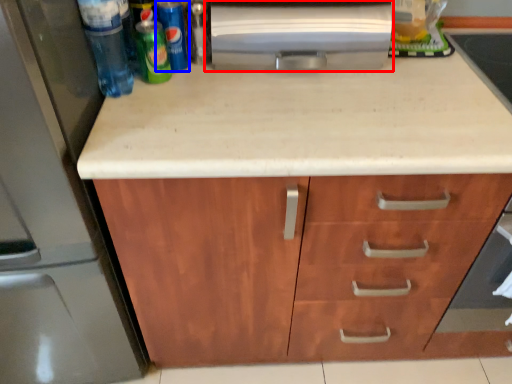
Question: Which object appears closest to the camera in this image, appliance (highlighted by a red box) or beer (highlighted by a blue box)?

Choices:
 (A) appliance
 (B) beer

Answer: (A)